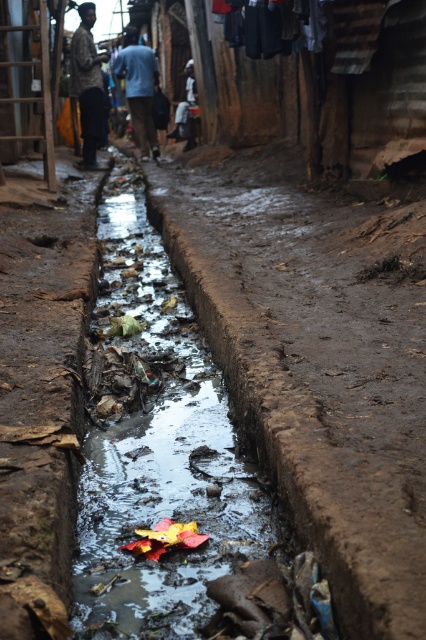
Question: Is blue cotton shirt at upper center below dark blue fabric at center?

Choices:
 (A) yes
 (B) no

Answer: (A)

Question: Which of these objects is positioned farthest from the blue cotton shirt at upper center?

Choices:
 (A) dark blue fabric at center
 (B) patterned fabric shirt at upper left
 (C) dark blue fabric at upper center
 (D) muddy stream at center

Answer: (D)

Question: Does dark blue fabric at upper center appear under dark blue fabric at center?

Choices:
 (A) yes
 (B) no

Answer: (A)

Question: Which point appears closest to the camera in this image?

Choices:
 (A) (282, 42)
 (B) (95, 51)

Answer: (A)

Question: Does muddy stream at center lie in front of dark blue fabric at upper center?

Choices:
 (A) no
 (B) yes

Answer: (B)

Question: Which object is closer to the camera taking this photo?

Choices:
 (A) blue cotton shirt at upper center
 (B) dark blue fabric at upper center
 (C) patterned fabric shirt at upper left

Answer: (B)